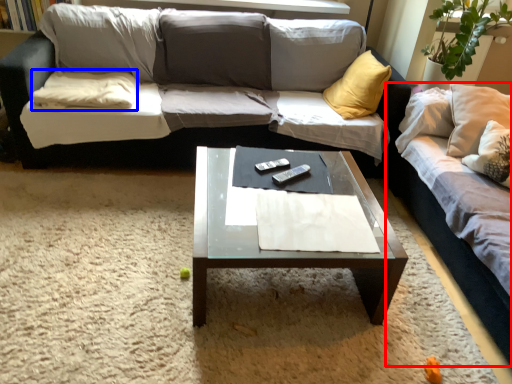
Question: Which of the following is the farthest to the observer, studio couch (highlighted by a red box) or pillow (highlighted by a blue box)?

Choices:
 (A) studio couch
 (B) pillow

Answer: (B)